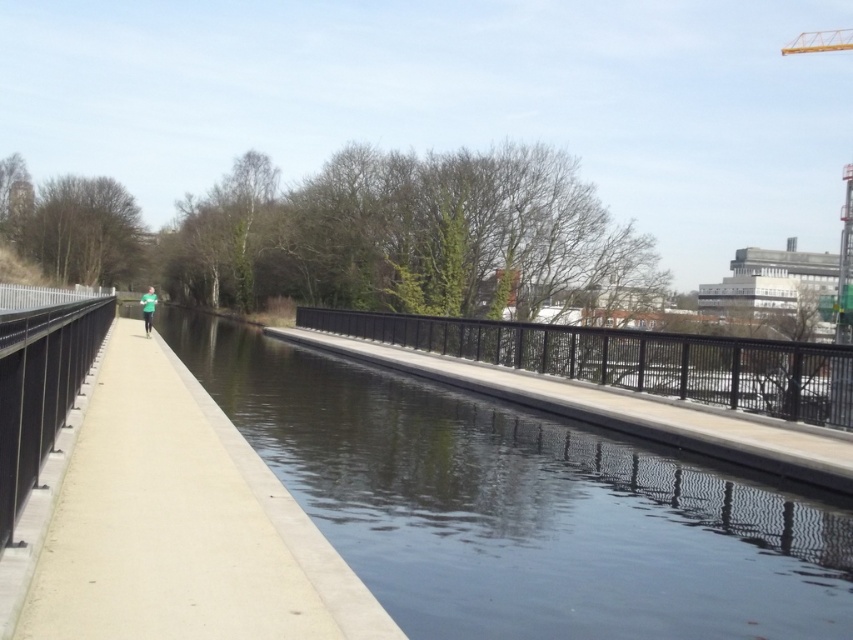
In the scene shown: You are a delivery person with a 10 feet wide cart. You need to cross the smooth concrete river at center. Is your cart able to cross it?

The smooth concrete river at center is 16.04 feet wide, so the cart which is 10 feet wide can cross it since it is narrower than the river.

You need to place a 2 meter wide bench on the concrete sidewalk at center or the black metal rail at center. Which location can accommodate the bench without exceeding its width?

The black metal rail at center has a greater width than the concrete sidewalk at center, so placing the 2 meter wide bench on the black metal rail at center would be possible since it can accommodate the bench without exceeding its width.

You are a delivery person who needs to cross from the smooth concrete river at center to the concrete sidewalk at center. Which direction should you move to reach the sidewalk?

The smooth concrete river at center is on the right side of the concrete sidewalk at center, so you should move to the left to reach the sidewalk.